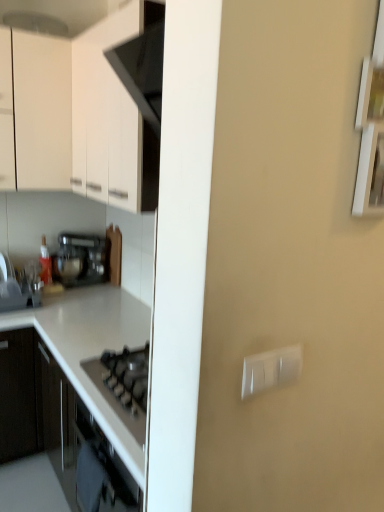
Question: Does white matte cabinet at upper left have a smaller size compared to satin black toaster at left?

Choices:
 (A) no
 (B) yes

Answer: (A)

Question: Does white matte cabinet at upper left appear on the left side of satin black toaster at left?

Choices:
 (A) yes
 (B) no

Answer: (B)

Question: Is white matte cabinet at upper left next to satin black toaster at left and touching it?

Choices:
 (A) yes
 (B) no

Answer: (B)

Question: From a real-world perspective, is white matte cabinet at upper left on top of satin black toaster at left?

Choices:
 (A) yes
 (B) no

Answer: (A)

Question: Is white matte cabinet at upper left at the right side of satin black toaster at left?

Choices:
 (A) no
 (B) yes

Answer: (B)

Question: Are white matte cabinet at upper left and satin black toaster at left located far from each other?

Choices:
 (A) yes
 (B) no

Answer: (B)

Question: Is white glossy countertop at lower left placed right next to satin black toaster at left?

Choices:
 (A) no
 (B) yes

Answer: (A)

Question: From the image's perspective, would you say white glossy countertop at lower left is positioned over satin black toaster at left?

Choices:
 (A) no
 (B) yes

Answer: (A)

Question: Is white glossy countertop at lower left bigger than satin black toaster at left?

Choices:
 (A) no
 (B) yes

Answer: (B)

Question: Is white glossy countertop at lower left closer to camera compared to satin black toaster at left?

Choices:
 (A) no
 (B) yes

Answer: (B)

Question: Is white glossy countertop at lower left smaller than satin black toaster at left?

Choices:
 (A) no
 (B) yes

Answer: (A)

Question: Considering the relative positions of white glossy countertop at lower left and satin black toaster at left in the image provided, is white glossy countertop at lower left to the right of satin black toaster at left from the viewer's perspective?

Choices:
 (A) no
 (B) yes

Answer: (A)

Question: From the image's perspective, is white glossy countertop at lower left below white matte cabinet at upper left?

Choices:
 (A) no
 (B) yes

Answer: (B)